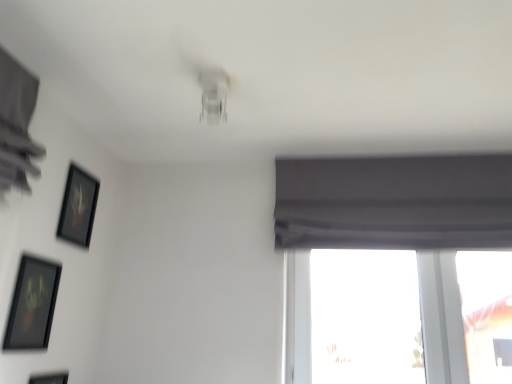
Question: Considering the relative sizes of matte black picture frame at lower left, which is the second picture frame from bottom to top, and transparent glass window at lower right in the image provided, is matte black picture frame at lower left, which is the second picture frame from bottom to top, smaller than transparent glass window at lower right?

Choices:
 (A) yes
 (B) no

Answer: (A)

Question: Does matte black picture frame at lower left, which is counted as the second picture frame, starting from the top, have a larger size compared to transparent glass window at lower right?

Choices:
 (A) yes
 (B) no

Answer: (B)

Question: Does matte black picture frame at lower left, which is counted as the second picture frame, starting from the top, come behind transparent glass window at lower right?

Choices:
 (A) yes
 (B) no

Answer: (B)

Question: Is matte black picture frame at lower left, which is the second picture frame from bottom to top, positioned before transparent glass window at lower right?

Choices:
 (A) no
 (B) yes

Answer: (B)

Question: Is matte black picture frame at lower left, which is the second picture frame from bottom to top, oriented towards transparent glass window at lower right?

Choices:
 (A) no
 (B) yes

Answer: (A)

Question: From their relative heights in the image, would you say matte black picture frame at lower left, which ranks as the 3th picture frame in top-to-bottom order, is taller or shorter than transparent glass window at lower right?

Choices:
 (A) tall
 (B) short

Answer: (B)

Question: Based on their sizes in the image, would you say matte black picture frame at lower left, which ranks as the first picture frame in bottom-to-top order, is bigger or smaller than transparent glass window at lower right?

Choices:
 (A) small
 (B) big

Answer: (A)

Question: From a real-world perspective, relative to transparent glass window at lower right, is matte black picture frame at lower left, which ranks as the first picture frame in bottom-to-top order, vertically above or below?

Choices:
 (A) above
 (B) below

Answer: (B)

Question: Is matte black picture frame at lower left, which ranks as the 3th picture frame in top-to-bottom order, wider or thinner than transparent glass window at lower right?

Choices:
 (A) wide
 (B) thin

Answer: (B)

Question: In terms of width, does black matte picture frame at upper left, the 1th picture frame from the top, look wider or thinner when compared to matte black picture frame at lower left, which is counted as the second picture frame, starting from the top?

Choices:
 (A) wide
 (B) thin

Answer: (A)

Question: From a real-world perspective, relative to matte black picture frame at lower left, which is the second picture frame from bottom to top, is black matte picture frame at upper left, which is the third picture frame from bottom to top, vertically above or below?

Choices:
 (A) above
 (B) below

Answer: (A)

Question: Looking at the image, does black matte picture frame at upper left, the 1th picture frame from the top, seem bigger or smaller compared to matte black picture frame at lower left, which is counted as the second picture frame, starting from the top?

Choices:
 (A) big
 (B) small

Answer: (A)

Question: Relative to matte black picture frame at lower left, which is counted as the second picture frame, starting from the top, is black matte picture frame at upper left, which is the third picture frame from bottom to top, in front or behind?

Choices:
 (A) front
 (B) behind

Answer: (B)

Question: In terms of height, does black matte picture frame at upper left, the 1th picture frame from the top, look taller or shorter compared to matte black picture frame at lower left, which ranks as the first picture frame in bottom-to-top order?

Choices:
 (A) tall
 (B) short

Answer: (B)

Question: Is black matte picture frame at upper left, which is the third picture frame from bottom to top, wider or thinner than matte black picture frame at lower left, which ranks as the 3th picture frame in top-to-bottom order?

Choices:
 (A) thin
 (B) wide

Answer: (B)